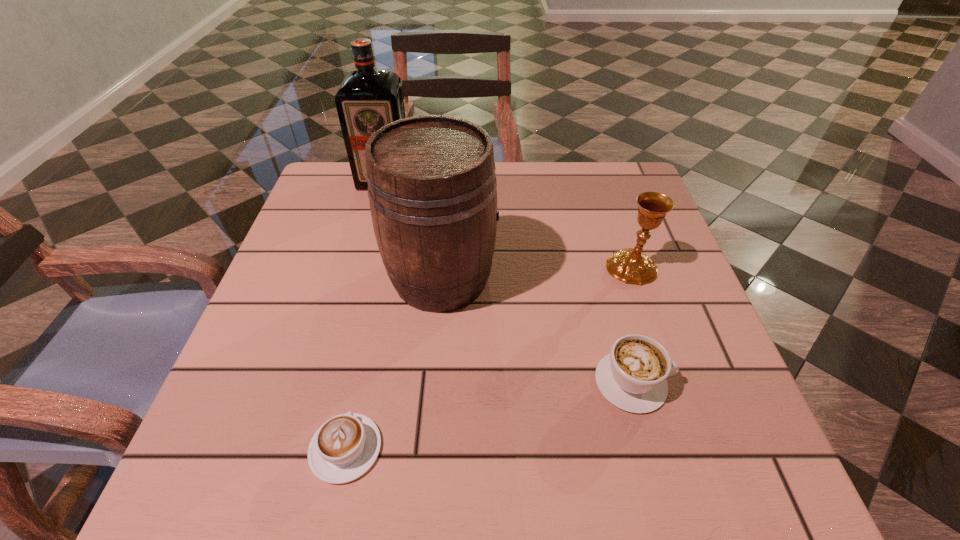
You are a GUI agent. You are given a task and a screenshot of the screen. Output one action in this format:
    pyautogui.click(x=<x>, y=<y>)
    Task: Click on the farthest object
    
    Given the screenshot: What is the action you would take?
    pyautogui.click(x=366, y=100)

The height and width of the screenshot is (540, 960). Find the location of `cider`. cider is located at coordinates (432, 188).

Where is `chalice`? The image size is (960, 540). chalice is located at coordinates (629, 265).

The width and height of the screenshot is (960, 540). Find the location of `the second nearest object`. the second nearest object is located at coordinates (632, 377).

I want to click on the right cappuccino, so click(632, 377).

This screenshot has width=960, height=540. Identify the location of the nearest object. (345, 447).

The width and height of the screenshot is (960, 540). Find the location of `the nearer cappuccino`. the nearer cappuccino is located at coordinates (345, 447).

Find the location of a particular element. free space located on the front label of the liquor is located at coordinates (372, 226).

Image resolution: width=960 pixels, height=540 pixels. What are the coordinates of `free region located 0.290m on the side of the cider near the bung hole` in the screenshot? It's located at (635, 278).

At what (x,y) coordinates should I click in order to perform the action: click on free space located 0.330m on the left of the chalice. Please return your answer as a coordinate pair (x, y). This screenshot has height=540, width=960. Looking at the image, I should click on (452, 267).